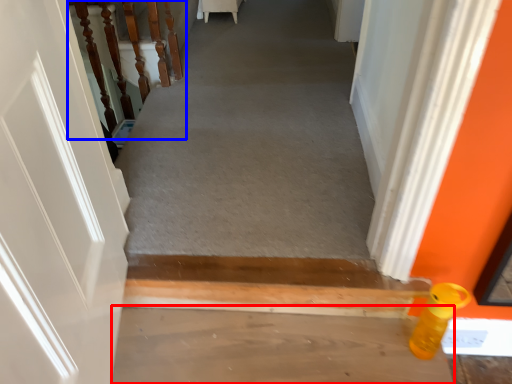
Question: Among these objects, which one is nearest to the camera, concrete (highlighted by a red box) or stairwell (highlighted by a blue box)?

Choices:
 (A) concrete
 (B) stairwell

Answer: (A)